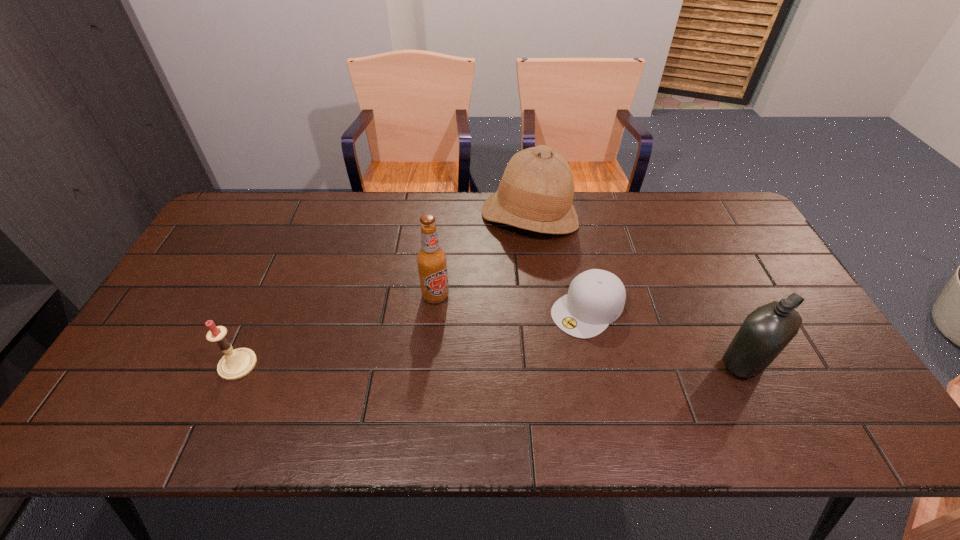
Image resolution: width=960 pixels, height=540 pixels. Find the location of `the leftmost object`. the leftmost object is located at coordinates (235, 364).

This screenshot has width=960, height=540. What are the coordinates of `the second shortest object` in the screenshot? It's located at (235, 364).

Locate an element on the screen. the third shortest object is located at coordinates (766, 331).

This screenshot has width=960, height=540. In order to click on the rightmost object in this screenshot , I will do `click(766, 331)`.

Image resolution: width=960 pixels, height=540 pixels. I want to click on the shortest object, so click(596, 298).

Locate an element on the screen. This screenshot has height=540, width=960. hat is located at coordinates (536, 192).

I want to click on beer bottle, so click(x=431, y=259).

The height and width of the screenshot is (540, 960). Identify the location of vacant region located 0.340m on the back of the leftmost object. (285, 258).

In order to click on free space located on the back of the rightmost object in this screenshot , I will do `click(707, 285)`.

This screenshot has height=540, width=960. Identify the location of vacant point located 0.130m on the front-facing side of the shortest object. (529, 356).